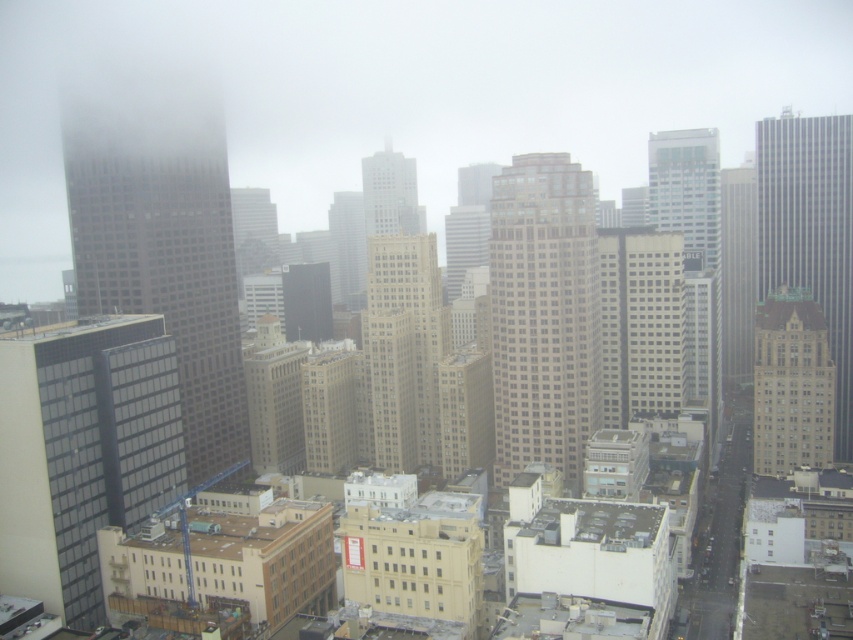
Does beige glass building at center lie in front of beige stone building at center?

Yes, beige glass building at center is in front of beige stone building at center.

Is point (564, 154) positioned in front of point (445, 337)?

Yes, it is.

Find the location of `beige glass building at center`. beige glass building at center is located at coordinates (543, 316).

Does gray glass skyscraper at right have a larger size compared to beige stone building at center-right?

Indeed, gray glass skyscraper at right has a larger size compared to beige stone building at center-right.

The width and height of the screenshot is (853, 640). What do you see at coordinates (810, 232) in the screenshot? I see `gray glass skyscraper at right` at bounding box center [810, 232].

Where is `gray glass skyscraper at right`? gray glass skyscraper at right is located at coordinates (810, 232).

Is gray concrete skyscraper at center bigger than silver glass skyscraper at center-right?

Actually, gray concrete skyscraper at center might be smaller than silver glass skyscraper at center-right.

This screenshot has height=640, width=853. What are the coordinates of `gray concrete skyscraper at center` in the screenshot? It's located at (640, 321).